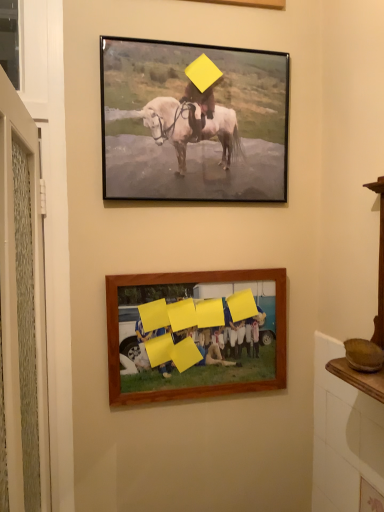
Question: Should I look upward or downward to see wooden frame at lower center, positioned as the second picture frame in top-to-bottom order?

Choices:
 (A) up
 (B) down

Answer: (B)

Question: Could you tell me if matte black frame at upper center, marked as the 1th picture frame in a top-to-bottom arrangement, is facing wooden frame at lower center, positioned as the second picture frame in top-to-bottom order?

Choices:
 (A) yes
 (B) no

Answer: (B)

Question: Does matte black frame at upper center, the 2th picture frame from the bottom, have a larger size compared to wooden frame at lower center, positioned as the first picture frame in bottom-to-top order?

Choices:
 (A) no
 (B) yes

Answer: (B)

Question: Is the position of matte black frame at upper center, marked as the 1th picture frame in a top-to-bottom arrangement, less distant than that of wooden frame at lower center, positioned as the second picture frame in top-to-bottom order?

Choices:
 (A) no
 (B) yes

Answer: (B)

Question: Considering the relative sizes of matte black frame at upper center, marked as the 1th picture frame in a top-to-bottom arrangement, and wooden frame at lower center, positioned as the first picture frame in bottom-to-top order, in the image provided, is matte black frame at upper center, marked as the 1th picture frame in a top-to-bottom arrangement, shorter than wooden frame at lower center, positioned as the first picture frame in bottom-to-top order,?

Choices:
 (A) no
 (B) yes

Answer: (A)

Question: From a real-world perspective, does matte black frame at upper center, the 2th picture frame from the bottom, sit lower than wooden frame at lower center, positioned as the first picture frame in bottom-to-top order?

Choices:
 (A) no
 (B) yes

Answer: (A)

Question: From a real-world perspective, is matte black frame at upper center, marked as the 1th picture frame in a top-to-bottom arrangement, over wooden frame at lower center, positioned as the first picture frame in bottom-to-top order?

Choices:
 (A) yes
 (B) no

Answer: (A)

Question: From a real-world perspective, is wooden frame at lower center, positioned as the second picture frame in top-to-bottom order, positioned under matte black frame at upper center, marked as the 1th picture frame in a top-to-bottom arrangement, based on gravity?

Choices:
 (A) no
 (B) yes

Answer: (B)

Question: Considering the relative sizes of wooden frame at lower center, positioned as the first picture frame in bottom-to-top order, and matte black frame at upper center, marked as the 1th picture frame in a top-to-bottom arrangement, in the image provided, is wooden frame at lower center, positioned as the first picture frame in bottom-to-top order, smaller than matte black frame at upper center, marked as the 1th picture frame in a top-to-bottom arrangement,?

Choices:
 (A) no
 (B) yes

Answer: (B)

Question: From the image's perspective, is wooden frame at lower center, positioned as the second picture frame in top-to-bottom order, below matte black frame at upper center, the 2th picture frame from the bottom?

Choices:
 (A) no
 (B) yes

Answer: (B)

Question: From a real-world perspective, is wooden frame at lower center, positioned as the first picture frame in bottom-to-top order, physically above matte black frame at upper center, marked as the 1th picture frame in a top-to-bottom arrangement?

Choices:
 (A) yes
 (B) no

Answer: (B)

Question: Is wooden frame at lower center, positioned as the second picture frame in top-to-bottom order, in front of matte black frame at upper center, marked as the 1th picture frame in a top-to-bottom arrangement?

Choices:
 (A) yes
 (B) no

Answer: (B)

Question: Is wooden frame at lower center, positioned as the first picture frame in bottom-to-top order, taller than matte black frame at upper center, the 2th picture frame from the bottom?

Choices:
 (A) yes
 (B) no

Answer: (B)

Question: From the image's perspective, is wooden frame at lower center, positioned as the second picture frame in top-to-bottom order, positioned above or below matte black frame at upper center, marked as the 1th picture frame in a top-to-bottom arrangement?

Choices:
 (A) above
 (B) below

Answer: (B)